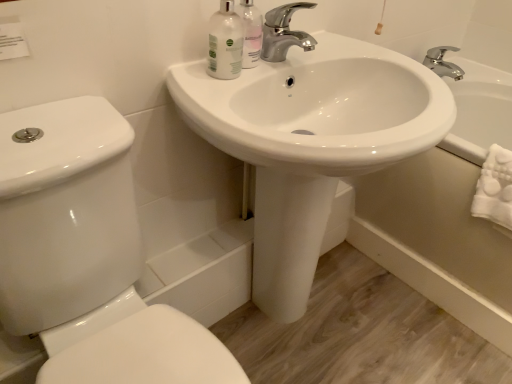
Question: Considering the positions of chrome metallic faucet at upper center and white glossy sink at center in the image, is chrome metallic faucet at upper center wider or thinner than white glossy sink at center?

Choices:
 (A) wide
 (B) thin

Answer: (B)

Question: Relative to white glossy sink at center, is chrome metallic faucet at upper center in front or behind?

Choices:
 (A) behind
 (B) front

Answer: (A)

Question: Estimate the real-world distances between objects in this image. Which object is farther from the translucent plastic mouthwash at upper center, the 1th mouthwash from the right?

Choices:
 (A) white glossy bathtub at lower right
 (B) chrome metallic faucet at upper center
 (C) white glossy sink at center
 (D) white glossy bottle at upper center, the 1th mouthwash viewed from the left
 (E) white glossy toilet at lower left

Answer: (A)

Question: Which object is positioned farthest from the white glossy bottle at upper center, acting as the 2th mouthwash starting from the right?

Choices:
 (A) white glossy sink at center
 (B) chrome metallic faucet at upper center
 (C) white glossy toilet at lower left
 (D) translucent plastic mouthwash at upper center, the 1th mouthwash from the right
 (E) white glossy bathtub at lower right

Answer: (E)